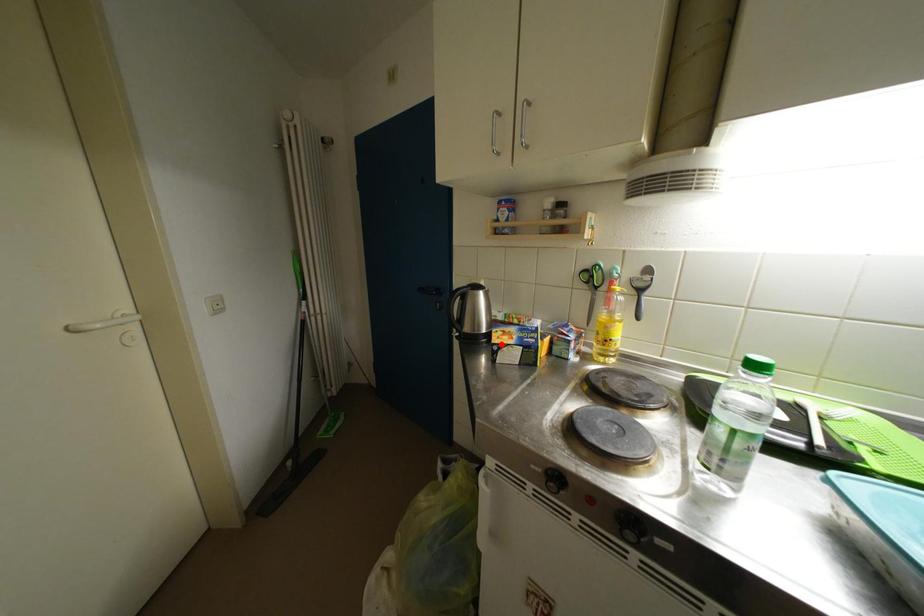
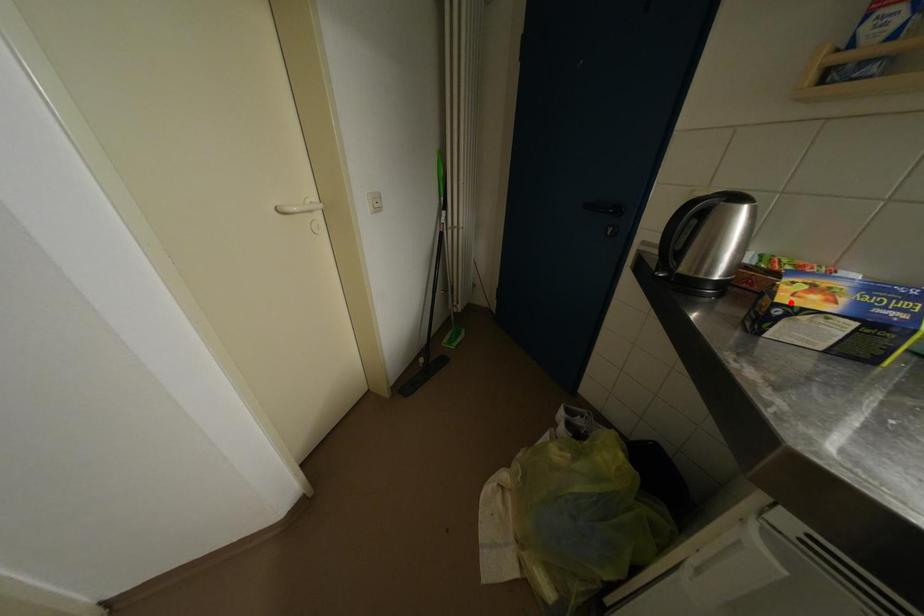
I am providing you with two images of the same scene from different viewpoints. A red point is marked on the first image and another point is marked on the second image. Do the highlighted points in image1 and image2 indicate the same real-world spot?

Yes